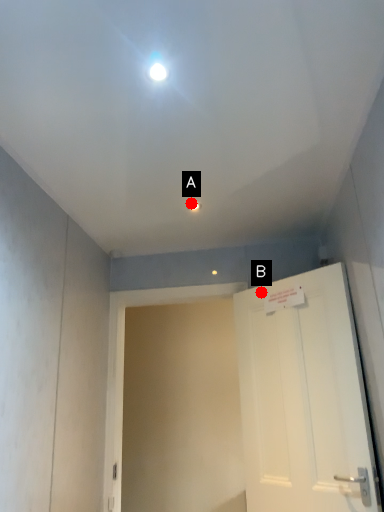
Question: Two points are circled on the image, labeled by A and B beside each circle. Which point is closer to the camera?

Choices:
 (A) A is closer
 (B) B is closer

Answer: (A)